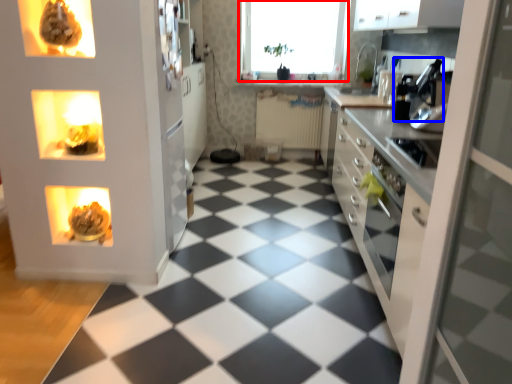
Question: Among these objects, which one is farthest to the camera, window (highlighted by a red box) or appliance (highlighted by a blue box)?

Choices:
 (A) window
 (B) appliance

Answer: (A)